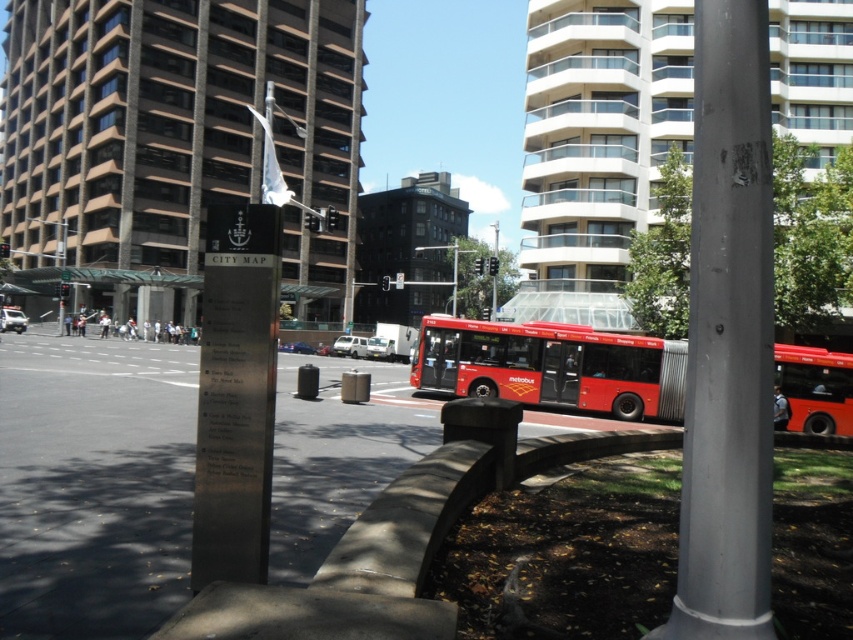
Can you confirm if gray metallic pole at center is taller than metallic red bus at center?

Yes, gray metallic pole at center is taller than metallic red bus at center.

Who is positioned more to the right, gray metallic pole at center or metallic red bus at center?

Positioned to the right is metallic red bus at center.

Where is `gray metallic pole at center`? gray metallic pole at center is located at coordinates (727, 337).

The width and height of the screenshot is (853, 640). I want to click on gray metallic pole at center, so click(x=727, y=337).